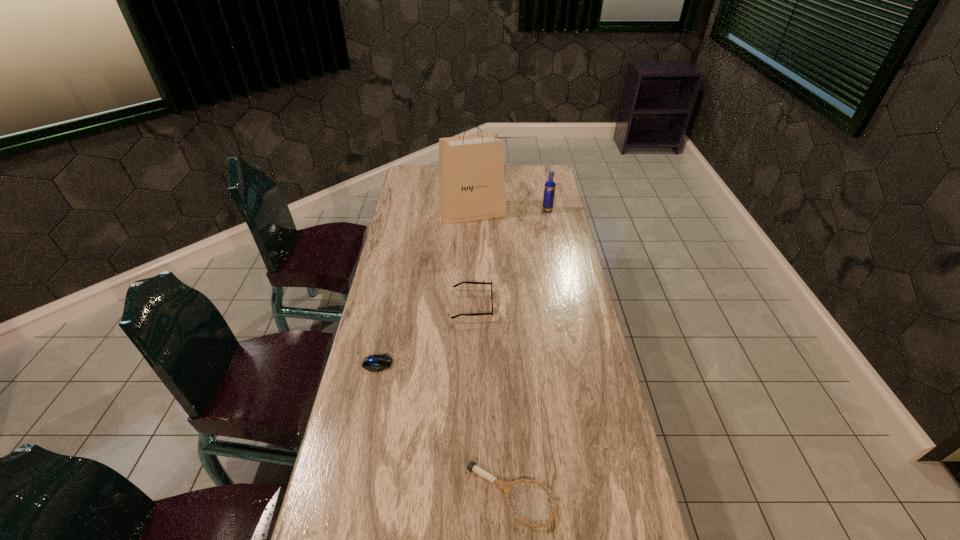
Find the location of a particular element. This screenshot has height=540, width=960. object that stands as the third closest to the nearest object is located at coordinates (471, 187).

Identify the location of free point that satisfies the following two spatial constraints: 1. on the button side of the fourth farthest object; 2. on the left side of the tennis racket. (349, 495).

Where is `vacant region that satisfies the following two spatial constraints: 1. on the front-facing side of the nearest object; 2. on the right side of the sunglasses`? This screenshot has width=960, height=540. vacant region that satisfies the following two spatial constraints: 1. on the front-facing side of the nearest object; 2. on the right side of the sunglasses is located at coordinates (468, 495).

Locate an element on the screen. The image size is (960, 540). free point that satisfies the following two spatial constraints: 1. on the back side of the nearest object; 2. on the button side of the leftmost object is located at coordinates (505, 364).